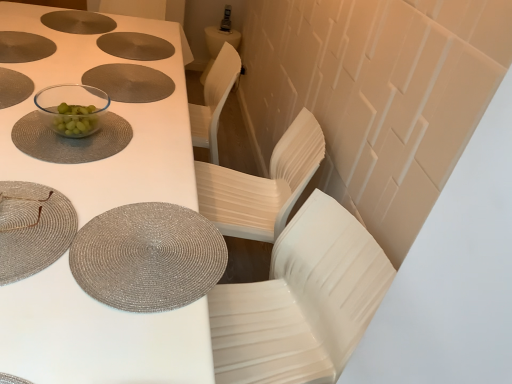
Question: Is silver woven placemat at lower left, which is the first tableware in front-to-back order, oriented towards transparent glass bowl at center, the third tableware when ordered from top to bottom?

Choices:
 (A) yes
 (B) no

Answer: (B)

Question: Considering the relative positions of silver woven placemat at lower left, positioned as the 5th tableware in back-to-front order, and transparent glass bowl at center, which ranks as the 3th tableware in bottom-to-top order, in the image provided, is silver woven placemat at lower left, positioned as the 5th tableware in back-to-front order, to the left of transparent glass bowl at center, which ranks as the 3th tableware in bottom-to-top order, from the viewer's perspective?

Choices:
 (A) yes
 (B) no

Answer: (A)

Question: Is silver woven placemat at lower left, arranged as the 2th tableware when ordered from the bottom, shorter than transparent glass bowl at center, which ranks as the 3th tableware in bottom-to-top order?

Choices:
 (A) no
 (B) yes

Answer: (B)

Question: Does silver woven placemat at lower left, which is the first tableware in front-to-back order, come behind transparent glass bowl at center, the third tableware when ordered from top to bottom?

Choices:
 (A) no
 (B) yes

Answer: (A)

Question: Does silver woven placemat at lower left, positioned as the 5th tableware in back-to-front order, come in front of transparent glass bowl at center, the third tableware when ordered from top to bottom?

Choices:
 (A) yes
 (B) no

Answer: (A)

Question: Relative to silver woven placemat at lower left, acting as the fourth tableware starting from the top, is transparent glass bowl at center, the 2th tableware viewed from the top, in front or behind?

Choices:
 (A) front
 (B) behind

Answer: (B)

Question: Looking at their shapes, would you say transparent glass bowl at center, placed as the fourth tableware when sorted from bottom to top, is wider or thinner than silver woven placemat at lower left, positioned as the 5th tableware in back-to-front order?

Choices:
 (A) wide
 (B) thin

Answer: (B)

Question: From a real-world perspective, is transparent glass bowl at center, which appears as the 2th tableware when viewed from the back, positioned above or below silver woven placemat at lower left, acting as the fourth tableware starting from the top?

Choices:
 (A) above
 (B) below

Answer: (A)

Question: In the image, is transparent glass bowl at center, placed as the fourth tableware when sorted from bottom to top, on the left side or the right side of silver woven placemat at lower left, arranged as the 2th tableware when ordered from the bottom?

Choices:
 (A) right
 (B) left

Answer: (A)

Question: Is matte silver placemat at upper center, the fifth tableware when ordered from bottom to top, inside the boundaries of transparent glass bowl at center, positioned as the fourth tableware in front-to-back order, or outside?

Choices:
 (A) outside
 (B) inside

Answer: (A)

Question: Considering the positions of matte silver placemat at upper center, marked as the fifth tableware in a front-to-back arrangement, and transparent glass bowl at center, the 2th tableware viewed from the top, in the image, is matte silver placemat at upper center, marked as the fifth tableware in a front-to-back arrangement, wider or thinner than transparent glass bowl at center, the 2th tableware viewed from the top,?

Choices:
 (A) wide
 (B) thin

Answer: (A)

Question: From a real-world perspective, is matte silver placemat at upper center, the fifth tableware when ordered from bottom to top, above or below transparent glass bowl at center, placed as the fourth tableware when sorted from bottom to top?

Choices:
 (A) below
 (B) above

Answer: (A)

Question: In the image, is matte silver placemat at upper center, marked as the fifth tableware in a front-to-back arrangement, positioned in front of or behind transparent glass bowl at center, which appears as the 2th tableware when viewed from the back?

Choices:
 (A) behind
 (B) front

Answer: (A)

Question: From a real-world perspective, is transparent glass bowl at center, which appears as the 3th tableware when viewed from the front, physically located above or below silver woven placemat at lower left, arranged as the 2th tableware when ordered from the bottom?

Choices:
 (A) above
 (B) below

Answer: (B)

Question: Would you say transparent glass bowl at center, which appears as the 3th tableware when viewed from the front, is to the left or to the right of silver woven placemat at lower left, which is the first tableware in front-to-back order, in the picture?

Choices:
 (A) left
 (B) right

Answer: (B)